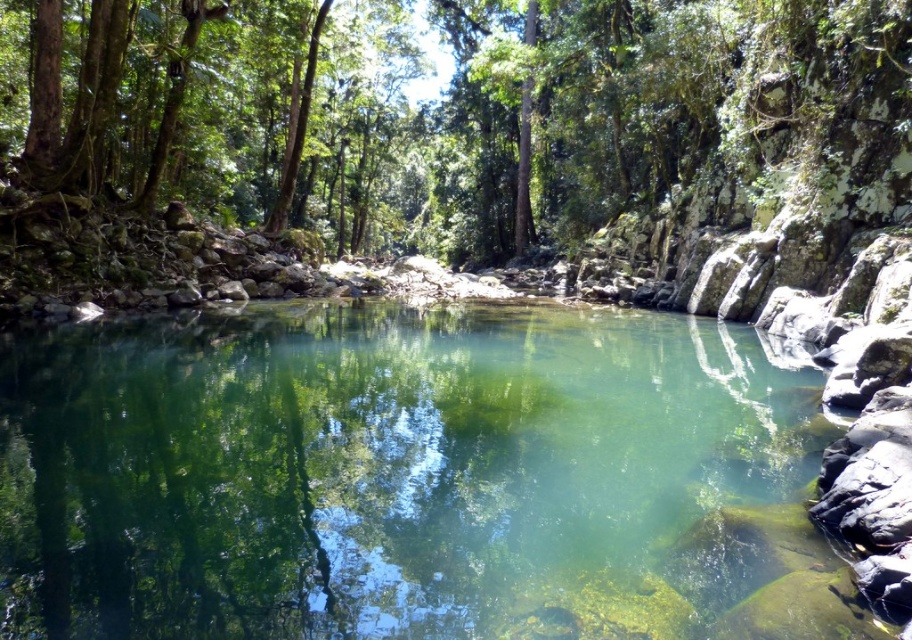
Question: Among these points, which one is farthest from the camera?

Choices:
 (A) (64, 182)
 (B) (268, 412)

Answer: (A)

Question: Which of the following is the farthest from the observer?

Choices:
 (A) (491, 388)
 (B) (306, 196)

Answer: (B)

Question: Among these objects, which one is nearest to the camera?

Choices:
 (A) green leafy tree at center
 (B) clear glassy water at center

Answer: (B)

Question: Does clear glassy water at center appear under green leafy tree at center?

Choices:
 (A) yes
 (B) no

Answer: (A)

Question: Is clear glassy water at center wider than green leafy tree at center?

Choices:
 (A) yes
 (B) no

Answer: (B)

Question: Is the position of clear glassy water at center more distant than that of green leafy tree at center?

Choices:
 (A) no
 (B) yes

Answer: (A)